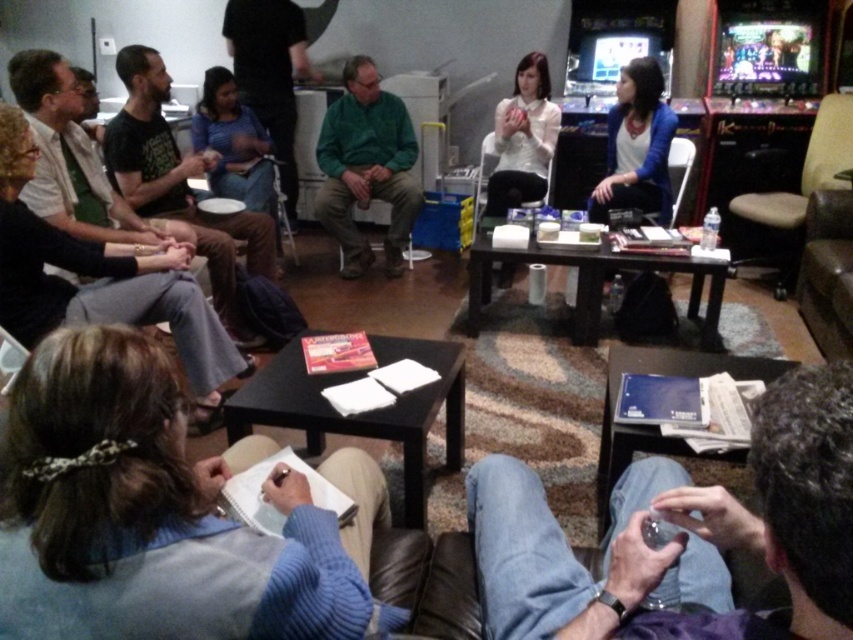
Question: Can you confirm if metallic silver phone at lower right is thinner than dark blue shirt at upper center?

Choices:
 (A) no
 (B) yes

Answer: (B)

Question: Can you confirm if metallic silver phone at lower right is thinner than dark blue shirt at upper center?

Choices:
 (A) yes
 (B) no

Answer: (A)

Question: Which of the following is the farthest from the observer?

Choices:
 (A) (741, 220)
 (B) (526, 170)
 (C) (695, 496)

Answer: (B)

Question: Can you confirm if green matte jacket at center is positioned above dark blue shirt at upper center?

Choices:
 (A) yes
 (B) no

Answer: (B)

Question: Among these points, which one is farthest from the camera?

Choices:
 (A) (815, 298)
 (B) (819, 170)
 (C) (805, 502)

Answer: (B)

Question: Which of the following is the farthest from the observer?

Choices:
 (A) (405, 122)
 (B) (271, 275)
 (C) (672, 460)

Answer: (A)